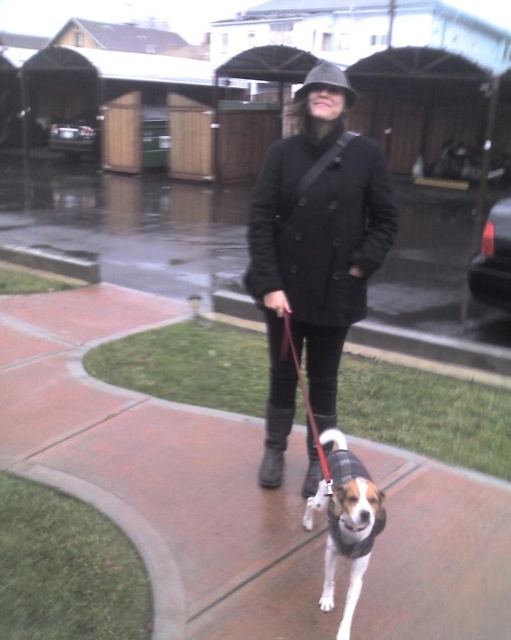
You are a delivery person trying to avoid getting wet in the rain. You see a matte black coat at center and a white and brown fur at center. Which one is closer to the shelter of the carport to your right?

The white and brown fur at center is closer to the shelter of the carport to your right because it is positioned to the right of the matte black coat at center.

You are a delivery robot navigating through the residential area. You need to move along the brown concrete sidewalk at center while avoiding the white nylon leash at center. Based on their positions, can you safely move along the sidewalk without stepping on the leash?

The brown concrete sidewalk at center is located below the white nylon leash at center, meaning the leash is above the sidewalk. Since the leash is above, the robot can safely move along the brown concrete sidewalk at center without stepping on the white nylon leash at center.